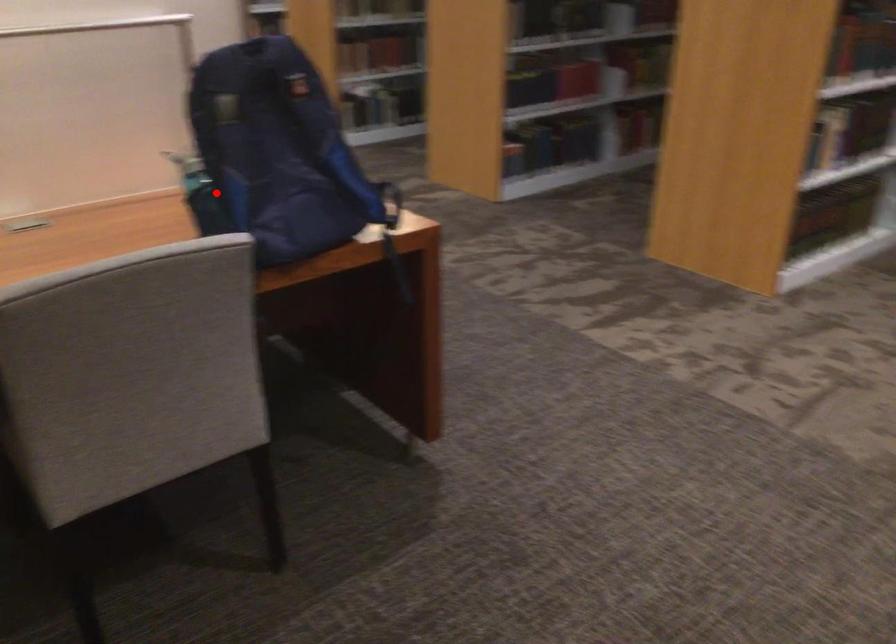
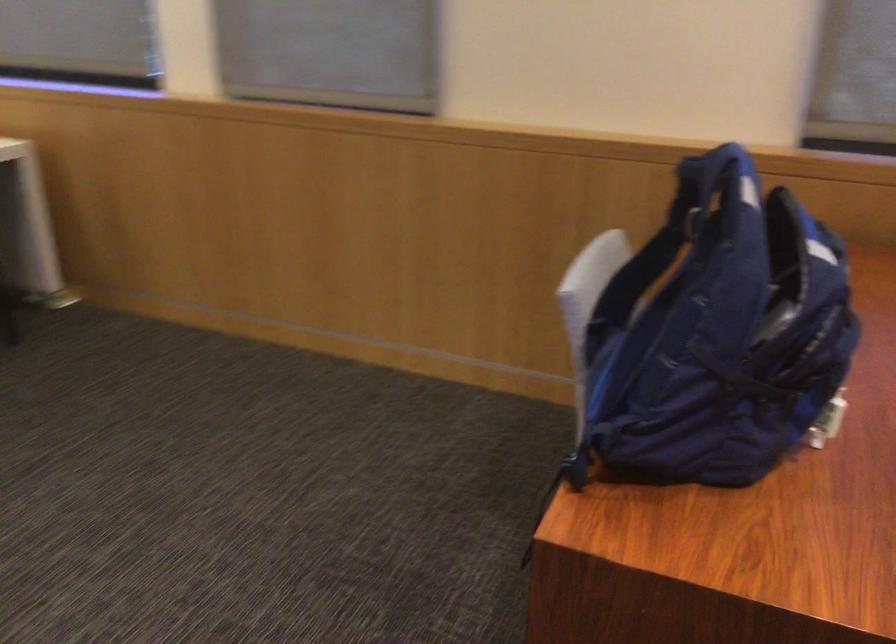
Question: I am providing you with two images of the same scene from different viewpoints. Image1 has a red point marked. In image2, the corresponding 3D location appears at what relative position? Reply with the corresponding letter.

Choices:
 (A) Closer
 (B) Farther

Answer: (A)